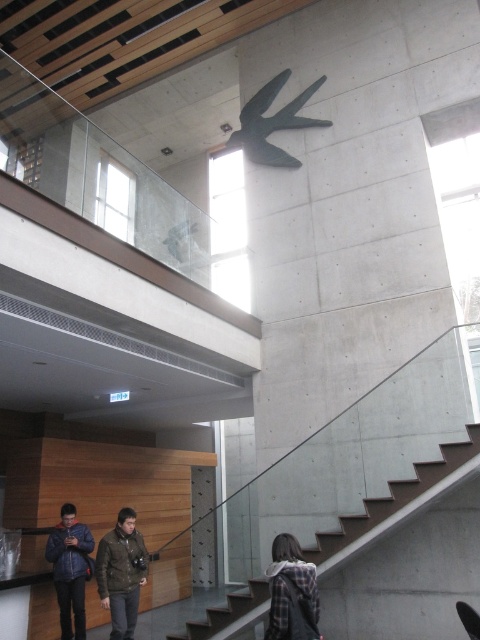
You are standing at the entrance of the space and want to retrieve the dark green jacket at lower center. Are the concrete stairs at center blocking your path to the jacket?

The concrete stairs at center is in front of dark green jacket at lower center, so yes, the stairs are blocking the path to the jacket.

You are organizing a charity clothing drive and need to pack jackets efficiently. You have a dark green jacket at lower center and a denim jacket at lower left. Which jacket should you choose to maximize the number of jackets you can fit into a limited space?

The dark green jacket at lower center occupies less space than the denim jacket at lower left, so choosing the dark green jacket at lower center allows you to fit more jackets into the limited space.

You are standing in the interior space described. You want to take a photo of the point at coordinates point (424, 490). If the camera can focus on objects within 15 feet, will it be able to focus on the point?

The point (424, 490) is 16.04 feet away from the camera, which is beyond the 15 feet focus range. The camera cannot focus on the point.